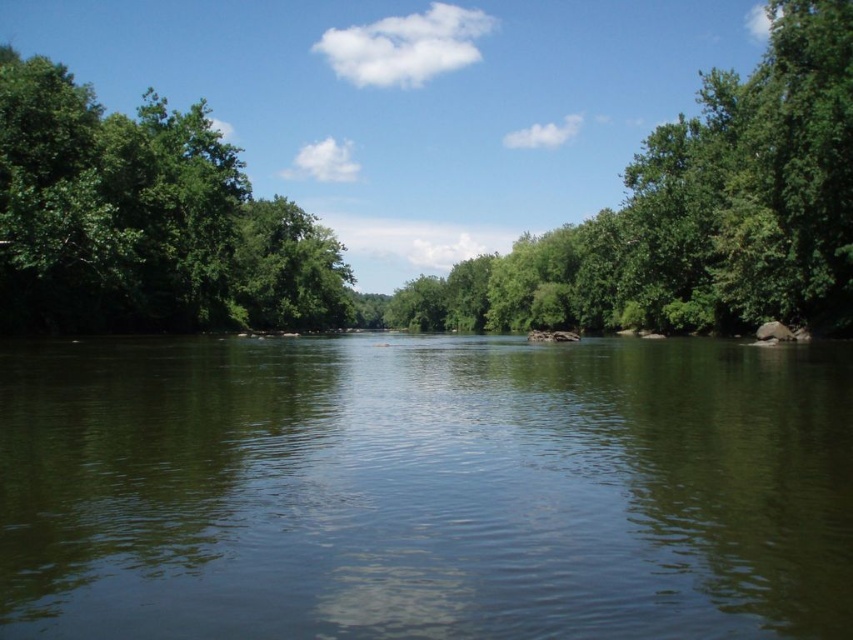
Does green smooth water at center appear over green leafy tree at left?

No, green smooth water at center is not above green leafy tree at left.

Locate an element on the screen. This screenshot has width=853, height=640. green smooth water at center is located at coordinates (424, 488).

The width and height of the screenshot is (853, 640). Find the location of `green smooth water at center`. green smooth water at center is located at coordinates (424, 488).

Does green smooth water at center appear on the right side of green leafy tree at center?

Incorrect, green smooth water at center is not on the right side of green leafy tree at center.

Which is behind, point (711, 400) or point (624, 230)?

The point (624, 230) is behind.

Is point (837, 518) behind point (813, 216)?

No, it is in front of (813, 216).

The image size is (853, 640). Find the location of `green smooth water at center`. green smooth water at center is located at coordinates (424, 488).

Does green leafy tree at center come behind green leafy tree at left?

That is False.

From the picture: Which is below, green leafy tree at center or green leafy tree at left?

Positioned lower is green leafy tree at center.

Measure the distance between green leafy tree at center and camera.

green leafy tree at center and camera are 186.13 feet apart.

I want to click on green leafy tree at center, so click(x=695, y=212).